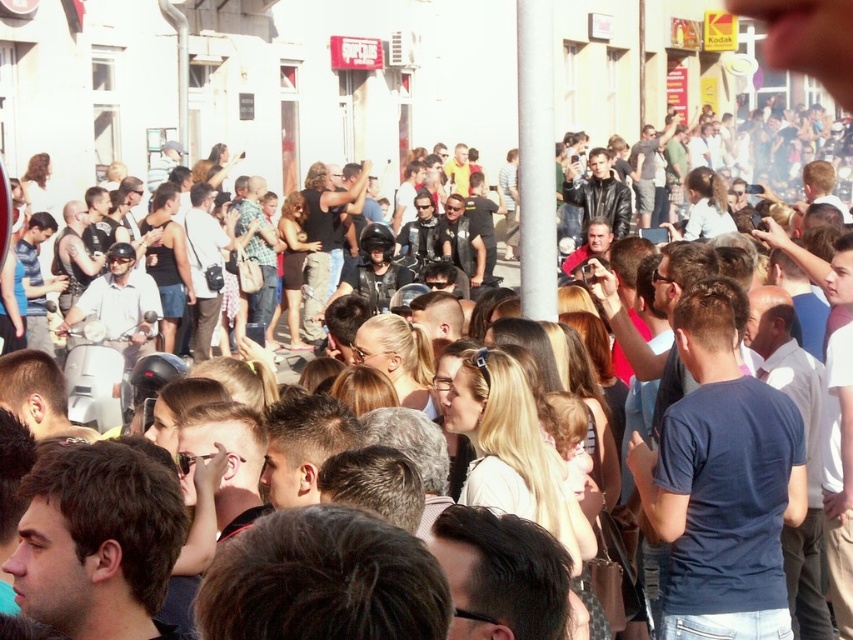
Which is above, dark blue t-shirt at center or white glossy pole at center?

white glossy pole at center is above.

I want to click on dark blue t-shirt at center, so click(721, 486).